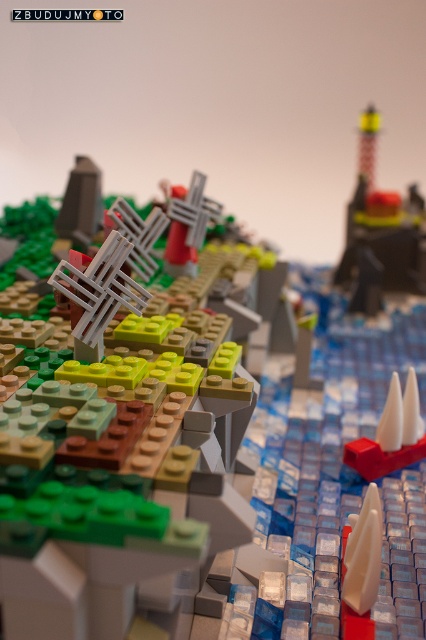
You are a bird flying over the Lego diorama. You see the point labeled as point (379, 234). What does this point represent in the scene?

The point labeled as point (379, 234) represents the smooth black lighthouse at upper right.